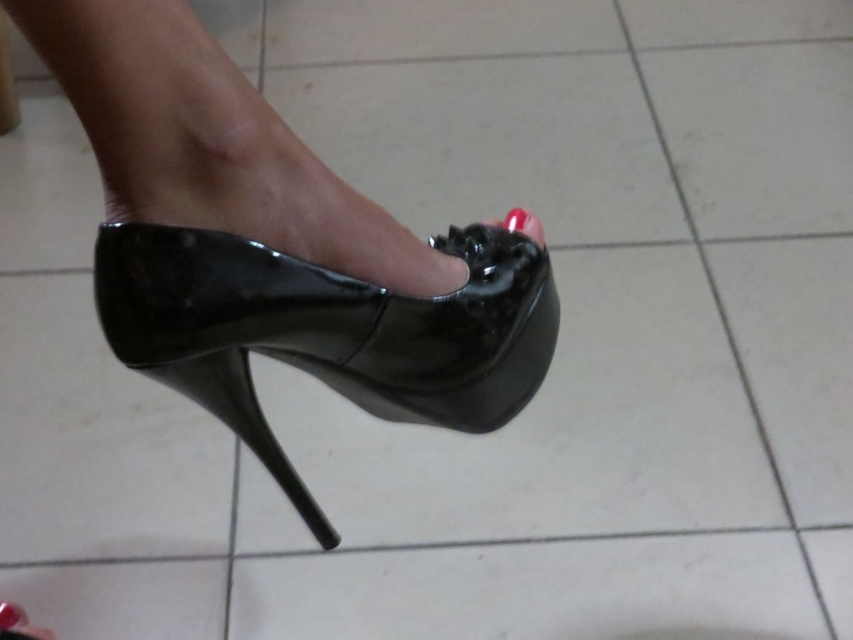
Question: Can you confirm if glossy black high-heeled shoe at center is positioned above glossy nail polish at center?

Choices:
 (A) yes
 (B) no

Answer: (B)

Question: Among these points, which one is nearest to the camera?

Choices:
 (A) (492, 240)
 (B) (544, 243)

Answer: (A)

Question: Does glossy black high-heeled shoe at center have a lesser width compared to glossy nail polish at center?

Choices:
 (A) no
 (B) yes

Answer: (A)

Question: Which object is farther from the camera taking this photo?

Choices:
 (A) glossy nail polish at center
 (B) glossy black high-heeled shoe at center

Answer: (A)

Question: Can you confirm if glossy black high-heeled shoe at center is thinner than glossy nail polish at center?

Choices:
 (A) no
 (B) yes

Answer: (A)

Question: Among these objects, which one is farthest from the camera?

Choices:
 (A) glossy black high-heeled shoe at center
 (B) glossy nail polish at center

Answer: (B)